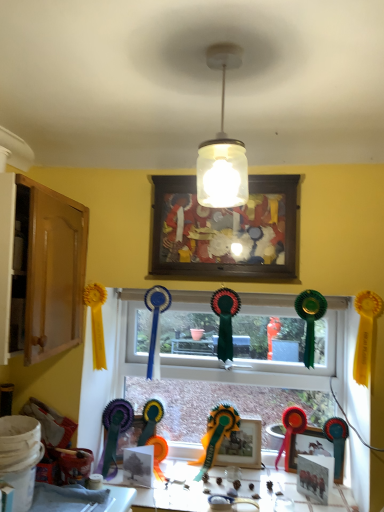
Question: Is wooden photo frame at center, which is the 1th picture frame from back to front, oriented away from matte plastic picture frame at lower right, which is the 3th picture frame in front-to-back order?

Choices:
 (A) no
 (B) yes

Answer: (A)

Question: Is wooden photo frame at center, arranged as the second picture frame when viewed from the top, further to camera compared to matte plastic picture frame at lower right, which is the third picture frame from top to bottom?

Choices:
 (A) yes
 (B) no

Answer: (A)

Question: Considering the relative sizes of wooden photo frame at center, which ranks as the 4th picture frame in front-to-back order, and matte plastic picture frame at lower right, which appears as the second picture frame when viewed from the back, in the image provided, is wooden photo frame at center, which ranks as the 4th picture frame in front-to-back order, smaller than matte plastic picture frame at lower right, which appears as the second picture frame when viewed from the back,?

Choices:
 (A) no
 (B) yes

Answer: (A)

Question: From the image's perspective, is wooden photo frame at center, arranged as the second picture frame when viewed from the top, on matte plastic picture frame at lower right, which is the 3th picture frame in front-to-back order?

Choices:
 (A) yes
 (B) no

Answer: (A)

Question: Can you confirm if wooden photo frame at center, arranged as the second picture frame when viewed from the top, is wider than matte plastic picture frame at lower right, which appears as the second picture frame when viewed from the back?

Choices:
 (A) yes
 (B) no

Answer: (A)

Question: From the image's perspective, is matte white picture frame at lower center, marked as the first picture frame in a bottom-to-top arrangement, above or below white glossy table at lower center?

Choices:
 (A) above
 (B) below

Answer: (A)

Question: In terms of size, does matte white picture frame at lower center, which appears as the 2th picture frame when viewed from the front, appear bigger or smaller than white glossy table at lower center?

Choices:
 (A) big
 (B) small

Answer: (B)

Question: Looking at their shapes, would you say matte white picture frame at lower center, which appears as the 2th picture frame when viewed from the front, is wider or thinner than white glossy table at lower center?

Choices:
 (A) thin
 (B) wide

Answer: (A)

Question: Is matte white picture frame at lower center, the fourth picture frame in the top-to-bottom sequence, inside the boundaries of white glossy table at lower center, or outside?

Choices:
 (A) inside
 (B) outside

Answer: (B)

Question: From the image's perspective, is matte white picture frame at lower center, marked as the first picture frame in a bottom-to-top arrangement, located above or below wooden cabinet at left?

Choices:
 (A) below
 (B) above

Answer: (A)

Question: Considering the positions of matte white picture frame at lower center, which is the third picture frame from back to front, and wooden cabinet at left in the image, is matte white picture frame at lower center, which is the third picture frame from back to front, wider or thinner than wooden cabinet at left?

Choices:
 (A) wide
 (B) thin

Answer: (B)

Question: Considering the positions of matte white picture frame at lower center, the fourth picture frame in the top-to-bottom sequence, and wooden cabinet at left in the image, is matte white picture frame at lower center, the fourth picture frame in the top-to-bottom sequence, bigger or smaller than wooden cabinet at left?

Choices:
 (A) small
 (B) big

Answer: (A)

Question: Does point (319, 478) appear closer or farther from the camera than point (44, 296)?

Choices:
 (A) farther
 (B) closer

Answer: (A)

Question: Considering the positions of white glossy table at lower center and matte green ribbon at center, which is the second toy from right to left, in the image, is white glossy table at lower center wider or thinner than matte green ribbon at center, which is the second toy from right to left,?

Choices:
 (A) thin
 (B) wide

Answer: (B)

Question: Looking at the image, does white glossy table at lower center seem bigger or smaller compared to matte green ribbon at center, which is the 1th toy in left-to-right order?

Choices:
 (A) big
 (B) small

Answer: (A)